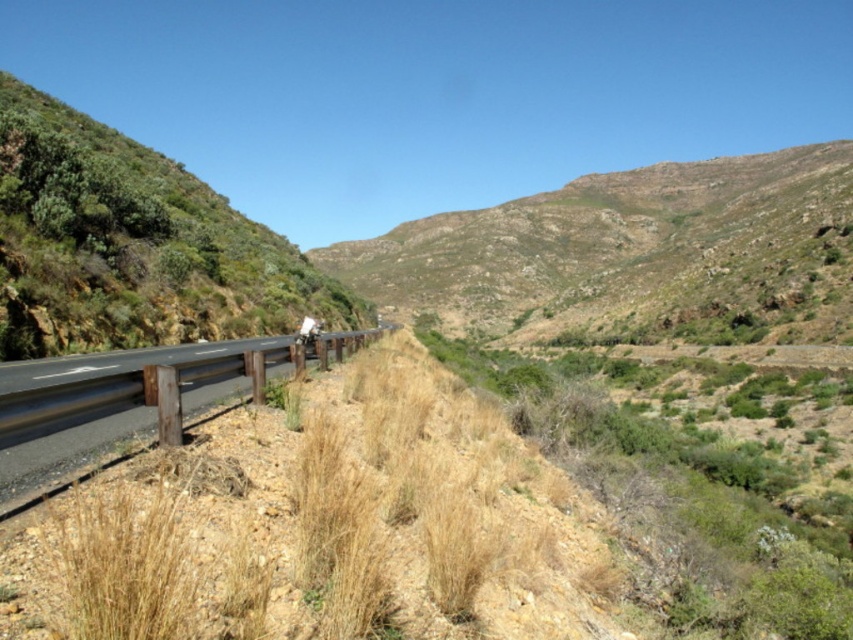
Does green grassy hillside at center appear on the right side of asphalt road at lower left?

Correct, you'll find green grassy hillside at center to the right of asphalt road at lower left.

Is green grassy hillside at center taller than asphalt road at lower left?

Yes.

Does point (672, 259) come farther from viewer compared to point (270, 368)?

Yes, point (672, 259) is farther from viewer.

Where is `green grassy hillside at center`? Image resolution: width=853 pixels, height=640 pixels. green grassy hillside at center is located at coordinates (634, 257).